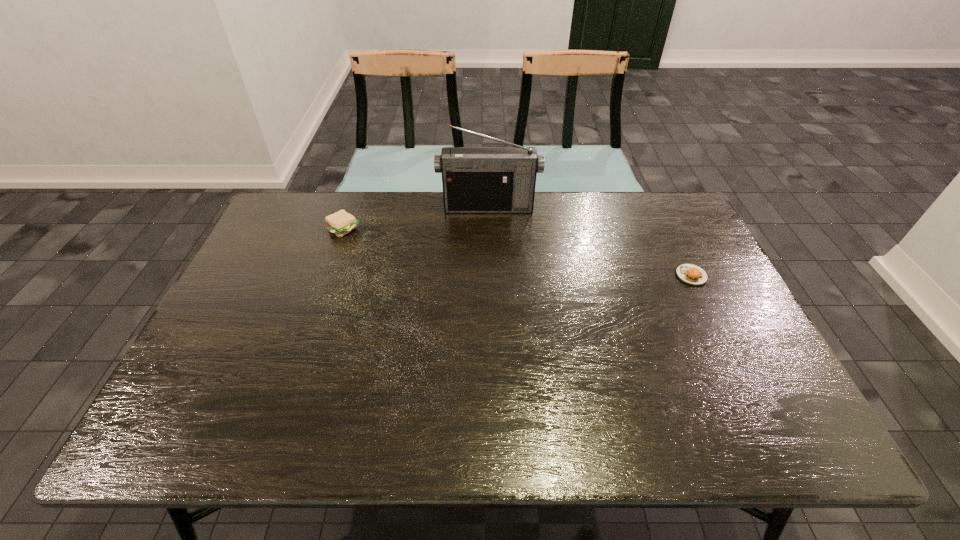
Where is `vacant region between the taller patty and the nearer patty`? This screenshot has height=540, width=960. vacant region between the taller patty and the nearer patty is located at coordinates (517, 252).

At what (x,y) coordinates should I click in order to perform the action: click on free spot between the second farthest object and the tallest object. Please return your answer as a coordinate pair (x, y). Looking at the image, I should click on (417, 218).

Where is `blank region between the second nearest object and the shorter patty`? The height and width of the screenshot is (540, 960). blank region between the second nearest object and the shorter patty is located at coordinates (517, 252).

This screenshot has width=960, height=540. What are the coordinates of `free area in between the second shortest object and the radio receiver` in the screenshot? It's located at (417, 218).

This screenshot has height=540, width=960. I want to click on empty space between the farther patty and the rightmost object, so [x=517, y=252].

Identify the location of empty location between the radio receiver and the farther patty. The height and width of the screenshot is (540, 960). (417, 218).

You are a GUI agent. You are given a task and a screenshot of the screen. Output one action in this format:
    pyautogui.click(x=<x>, y=<y>)
    Task: Click on the free space that is in between the farthest object and the nearest object
    
    Given the screenshot: What is the action you would take?
    pyautogui.click(x=589, y=241)

You are a GUI agent. You are given a task and a screenshot of the screen. Output one action in this format:
    pyautogui.click(x=<x>, y=<y>)
    Task: Click on the object that stands as the second closest to the left patty
    The height and width of the screenshot is (540, 960).
    Given the screenshot: What is the action you would take?
    pyautogui.click(x=690, y=274)

At what (x,y) coordinates should I click in order to perform the action: click on object that can be found as the closest to the shortest object. Please return your answer as a coordinate pair (x, y). The height and width of the screenshot is (540, 960). Looking at the image, I should click on (476, 180).

The width and height of the screenshot is (960, 540). I want to click on vacant space that satisfies the following two spatial constraints: 1. on the front-facing side of the nearer patty; 2. on the left side of the second object from right to left, so click(490, 275).